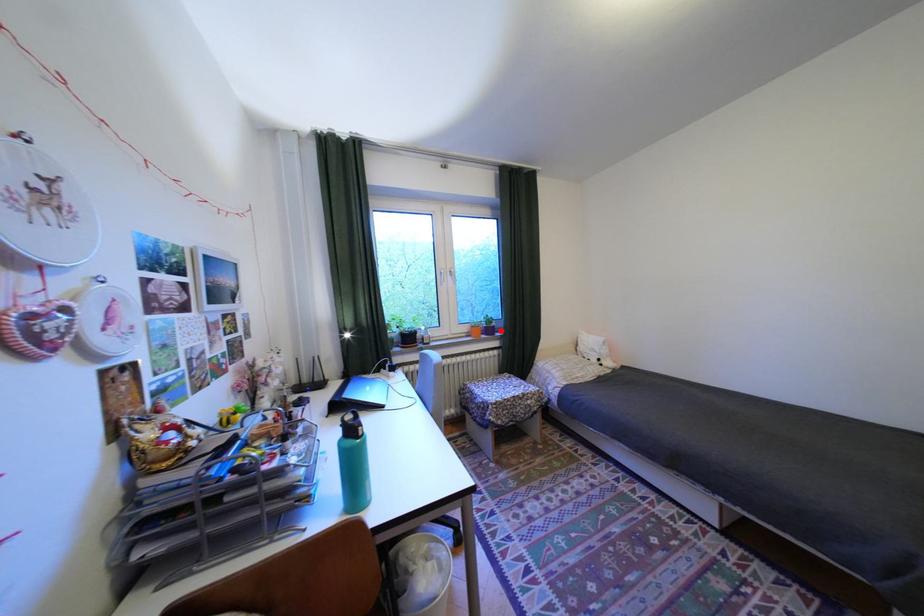
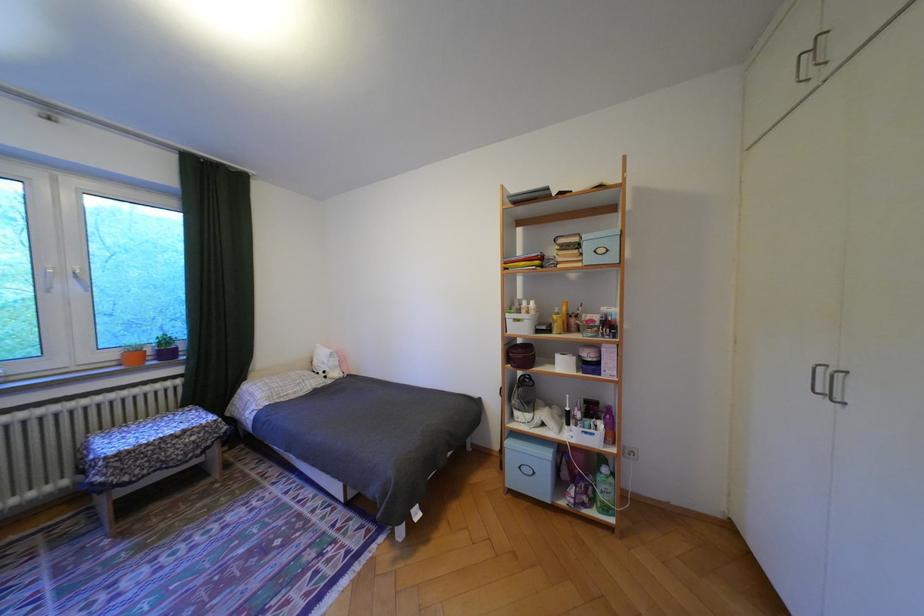
In the second image, find the point that corresponds to the highlighted location in the first image.

(178, 354)